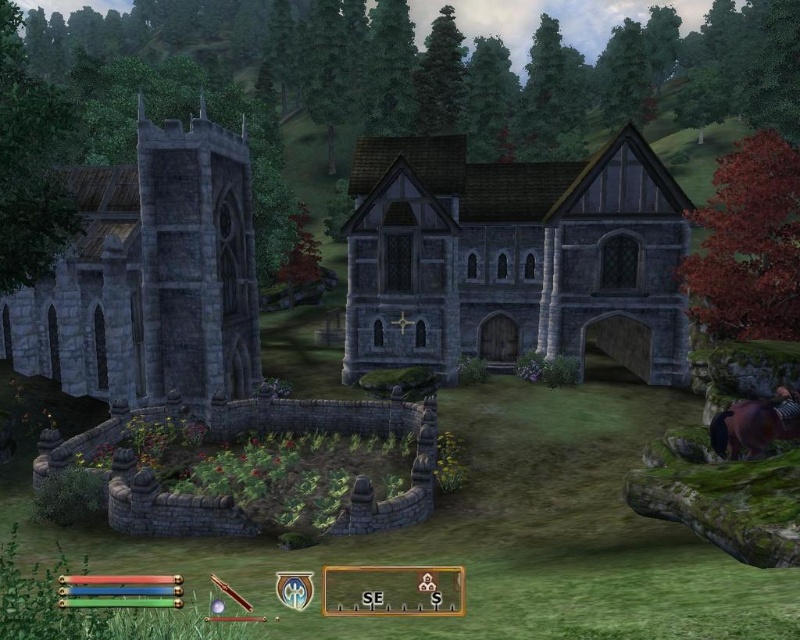
Can you confirm if stone/timber medieval building at center is taller than gray stone tower at left?

Incorrect, stone/timber medieval building at center's height is not larger of gray stone tower at left's.

Identify the location of stone/timber medieval building at center. The width and height of the screenshot is (800, 640). (513, 257).

Measure the distance between stone/timber medieval building at center and camera.

stone/timber medieval building at center is 22.11 meters from camera.

Where is `stone/timber medieval building at center`? This screenshot has width=800, height=640. stone/timber medieval building at center is located at coordinates (513, 257).